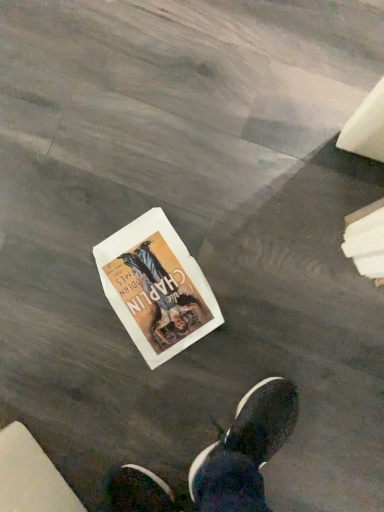
The height and width of the screenshot is (512, 384). Find the location of `blank space to the left of white paper at center`. blank space to the left of white paper at center is located at coordinates (66, 347).